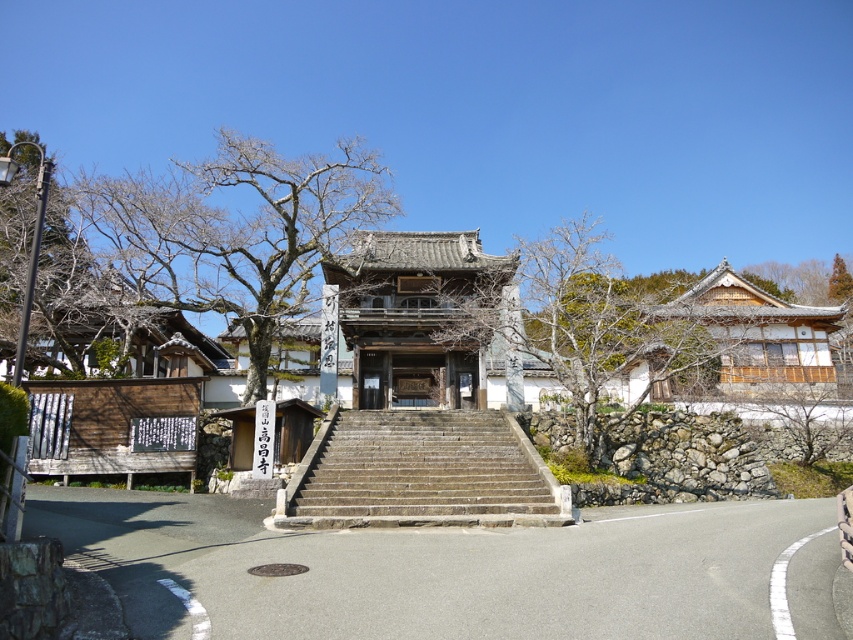
Question: Which of the following is the closest to the observer?

Choices:
 (A) stone textured stairs at center
 (B) bare wood tree at left
 (C) wooden temple at center

Answer: (B)

Question: Which point is closer to the camera?

Choices:
 (A) (639, 397)
 (B) (363, 400)
 (C) (463, 506)
 (D) (36, 266)

Answer: (D)

Question: Which point is farther from the camera taking this photo?

Choices:
 (A) (329, 490)
 (B) (665, 346)

Answer: (B)

Question: Can you confirm if stone textured stairs at center is positioned to the right of wooden temple at center?

Choices:
 (A) no
 (B) yes

Answer: (A)

Question: Can you confirm if stone textured stairs at center is smaller than bare wood tree at center?

Choices:
 (A) no
 (B) yes

Answer: (B)

Question: Does stone textured stairs at center have a greater width compared to bare wood tree at left?

Choices:
 (A) no
 (B) yes

Answer: (A)